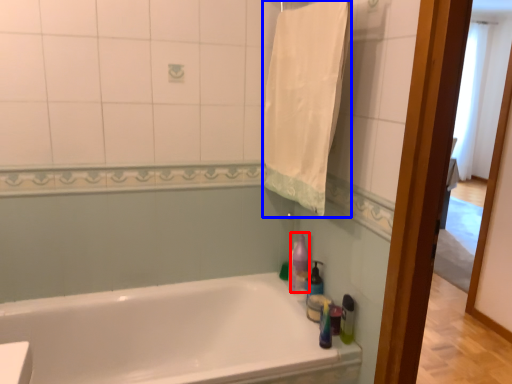
Question: Which object is closer to the camera taking this photo, cleaning product (highlighted by a red box) or bath towel (highlighted by a blue box)?

Choices:
 (A) cleaning product
 (B) bath towel

Answer: (B)